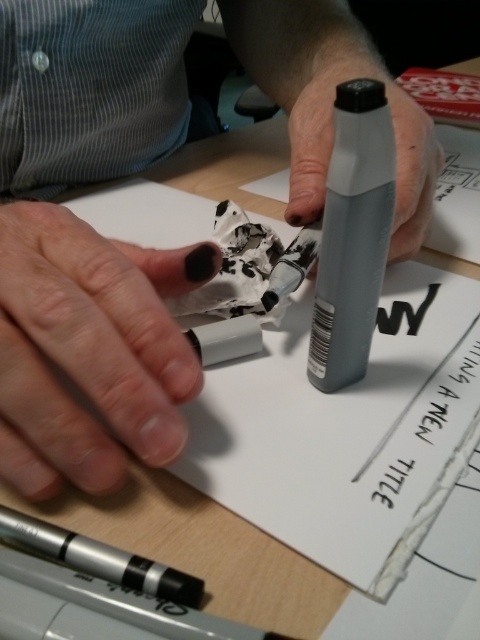
Consider the image. Which is above, matte plastic marker at center or black matte pen at center?

matte plastic marker at center

Image resolution: width=480 pixels, height=640 pixels. What do you see at coordinates (88, 349) in the screenshot?
I see `matte plastic marker at center` at bounding box center [88, 349].

You are a GUI agent. You are given a task and a screenshot of the screen. Output one action in this format:
    pyautogui.click(x=<x>, y=<y>)
    Task: Click on the matte plastic marker at center
    This screenshot has width=480, height=640.
    Given the screenshot: What is the action you would take?
    pyautogui.click(x=88, y=349)

Is matte plastic marker at center closer to camera compared to matte gray marker at center?

Yes, it is.

Between point (25, 493) and point (397, 177), which one is positioned in front?

Point (25, 493) is more forward.

This screenshot has height=640, width=480. Describe the element at coordinates (88, 349) in the screenshot. I see `matte plastic marker at center` at that location.

The image size is (480, 640). Find the location of `matte plastic marker at center`. matte plastic marker at center is located at coordinates (88, 349).

Is black matte pen at center closer to camera compared to matte gray marker at center?

Yes, it is.

From the picture: Does black matte pen at center have a larger size compared to matte gray marker at center?

Actually, black matte pen at center might be smaller than matte gray marker at center.

At what (x,y) coordinates should I click in order to perform the action: click on black matte pen at center. Please return your answer as a coordinate pair (x, y). Image resolution: width=480 pixels, height=640 pixels. Looking at the image, I should click on (88, 349).

In order to click on black matte pen at center in this screenshot , I will do `click(88, 349)`.